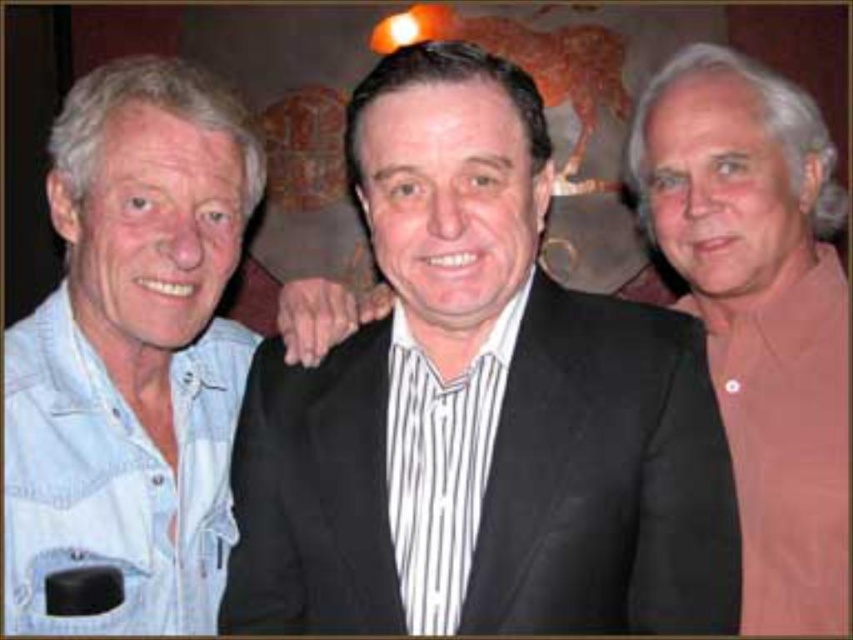
Question: Does black striped shirt at center appear over pink matte shirt at right?

Choices:
 (A) no
 (B) yes

Answer: (A)

Question: Can you confirm if black striped shirt at center is positioned to the left of pink matte shirt at right?

Choices:
 (A) no
 (B) yes

Answer: (B)

Question: Which point is farther to the camera?

Choices:
 (A) (680, 154)
 (B) (387, 200)

Answer: (A)

Question: Is black striped shirt at center below pink matte shirt at right?

Choices:
 (A) no
 (B) yes

Answer: (B)

Question: Among these objects, which one is farthest from the camera?

Choices:
 (A) pink matte shirt at right
 (B) black striped shirt at center

Answer: (A)